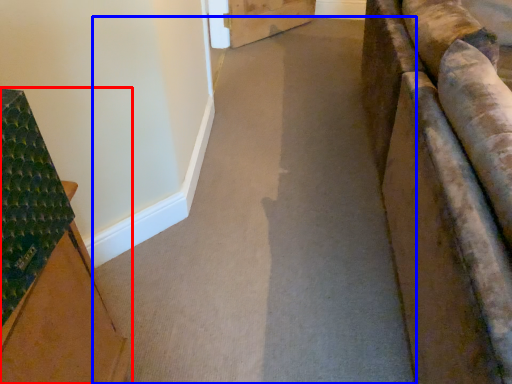
Question: Which point is further to the camera, furniture (highlighted by a red box) or path (highlighted by a blue box)?

Choices:
 (A) furniture
 (B) path

Answer: (B)